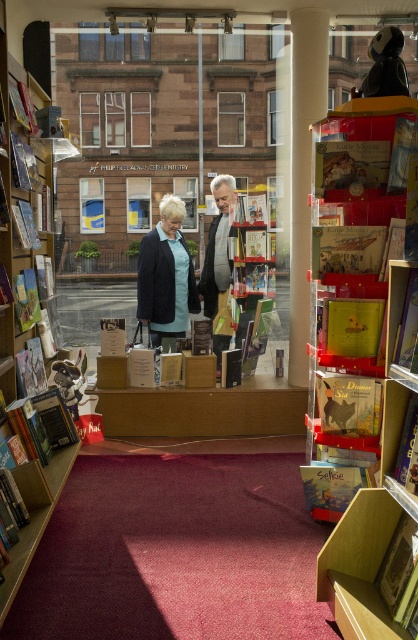
You are standing at the entrance of the bookstore and want to reach the matte plastic bookshelf at right. According to the coordinates provided, in which direction should you move relative to your current position?

The matte plastic bookshelf at right is located at coordinates point (359, 419), so you should move towards the right and slightly forward to reach it.

You are a customer in the bookstore and want to place a new book on the shelf. The new book is the same size as the hardcover book at center. Can the wooden bookshelf at left accommodate this new book?

The wooden bookshelf at left is larger in size than the hardcover book at center, so yes, the wooden bookshelf at left can accommodate the new book since it is bigger than the hardcover book at center.

You are organizing a bookshelf in the bookstore and need to place a gray wool sweater on a shelf. The wooden bookshelf at left has a certain width. Can you fit the gray wool sweater at center on the shelf without folding it?

The wooden bookshelf at left is wider than the gray wool sweater at center, so yes, the gray wool sweater at center can fit on the shelf without folding it.